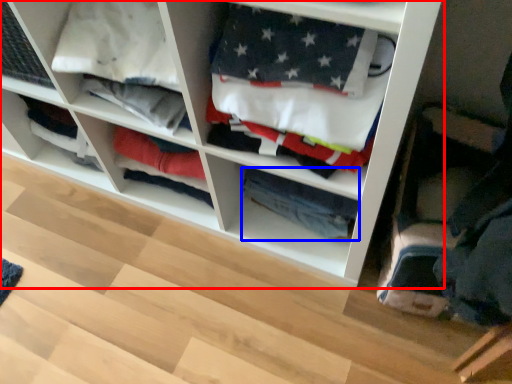
Question: Which point is closer to the camera, shelf (highlighted by a red box) or clothing (highlighted by a blue box)?

Choices:
 (A) shelf
 (B) clothing

Answer: (A)